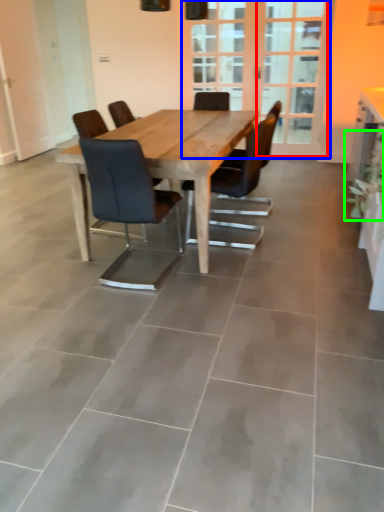
Question: Estimate the real-world distances between objects in this image. Which object is closer to screen door (highlighted by a red box), screen door (highlighted by a blue box) or plant (highlighted by a green box)?

Choices:
 (A) screen door
 (B) plant

Answer: (A)